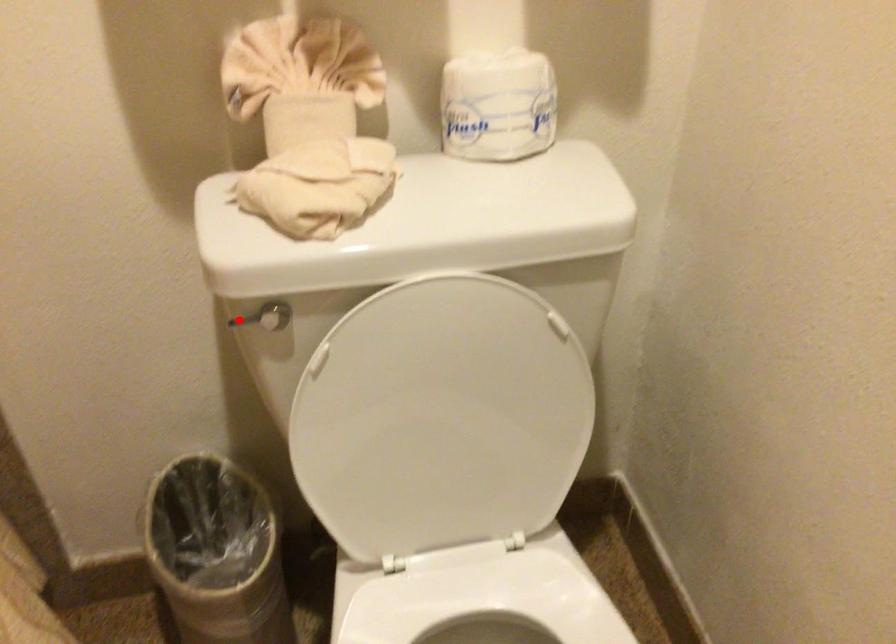
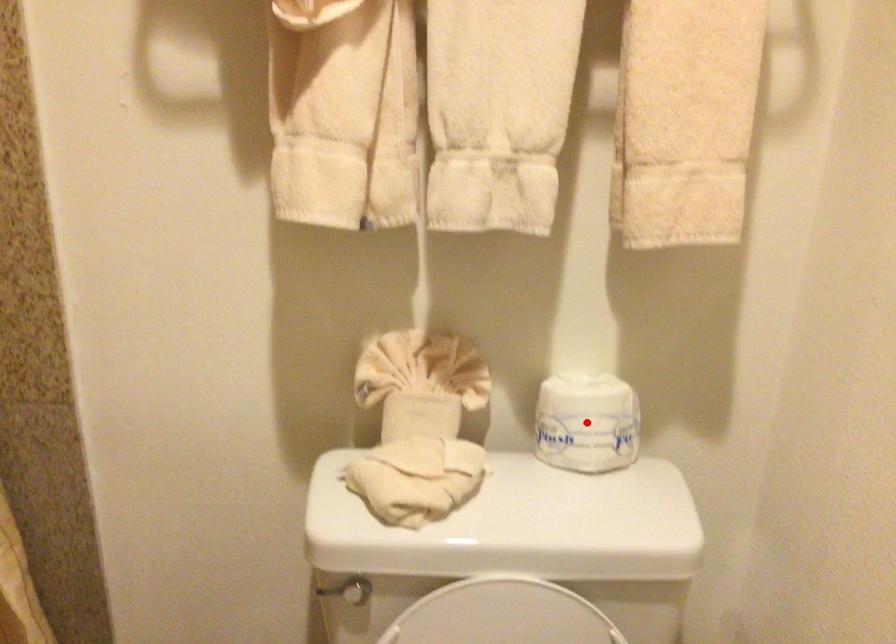
I am providing you with two images of the same scene from different viewpoints. A red point is marked on the first image and another point is marked on the second image. Does the point marked in image1 correspond to the same location as the one in image2?

No